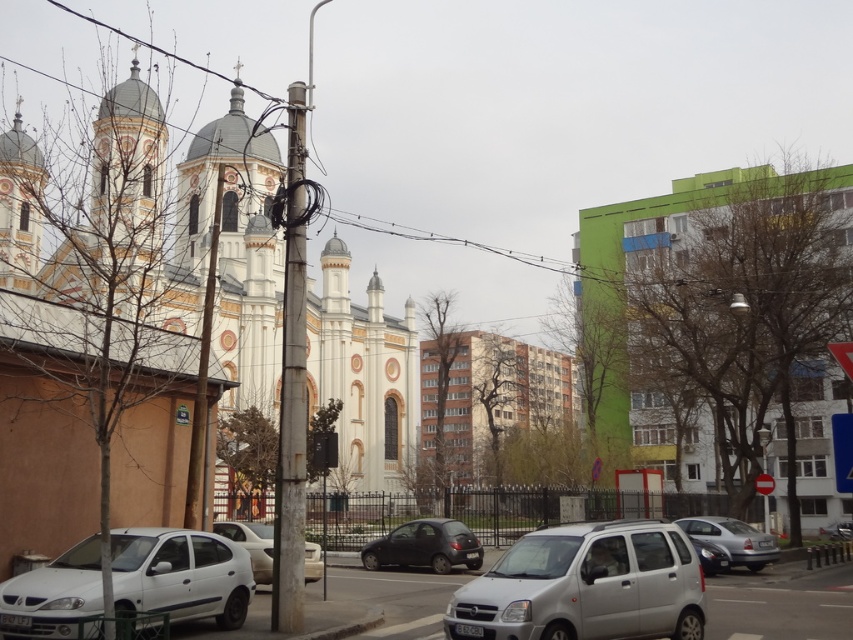
Looking at this image, can you confirm if green matte building at right is positioned to the right of silver metallic van at center?

Correct, you'll find green matte building at right to the right of silver metallic van at center.

Is point (727, 179) more distant than point (477, 588)?

Yes, it is.

I want to click on green matte building at right, so (723, 314).

Image resolution: width=853 pixels, height=640 pixels. What are the coordinates of `green matte building at right` in the screenshot? It's located at (723, 314).

Between rusty metal pole at center and silver metallic hatchback at center, which one is positioned lower?

Positioned lower is silver metallic hatchback at center.

Where is `rusty metal pole at center`? Image resolution: width=853 pixels, height=640 pixels. rusty metal pole at center is located at coordinates (291, 385).

Where is `rusty metal pole at center`? rusty metal pole at center is located at coordinates (291, 385).

Who is positioned more to the right, silver metallic van at center or white matte car at lower left?

Positioned to the right is silver metallic van at center.

Is point (509, 563) closer to viewer compared to point (39, 614)?

That is False.

Between point (633, 609) and point (230, 586), which one is positioned behind?

The point (230, 586) is more distant.

What are the coordinates of `silver metallic van at center` in the screenshot? It's located at (585, 586).